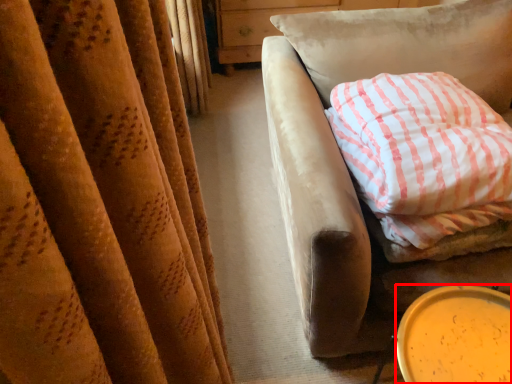
Question: Where is beverage (annotated by the red box) located in relation to pillow in the image?

Choices:
 (A) right
 (B) left

Answer: (B)